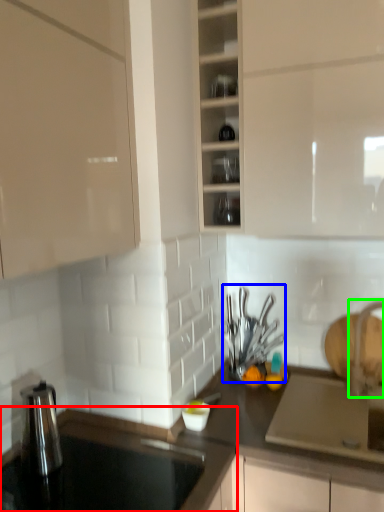
Question: Which object is the closest to the countertop (highlighted by a red box)? Choose among these: tableware (highlighted by a blue box) or faucet (highlighted by a green box).

Choices:
 (A) tableware
 (B) faucet

Answer: (A)